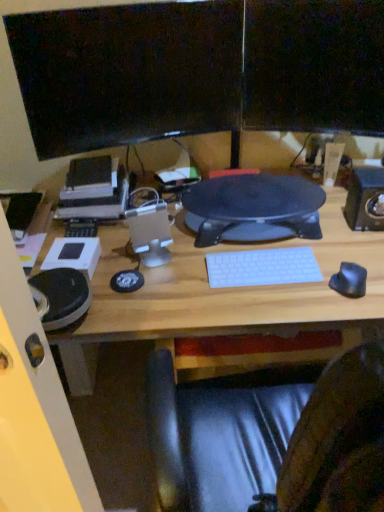
The width and height of the screenshot is (384, 512). Identify the location of free space on the front side of black textured mouse pad at center. (246, 291).